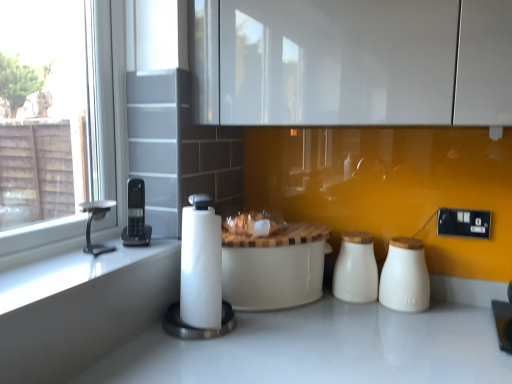
What are the coordinates of `blank space to the left of black plastic phone at left, which is the 2th appliance from right to left` in the screenshot? It's located at (86, 245).